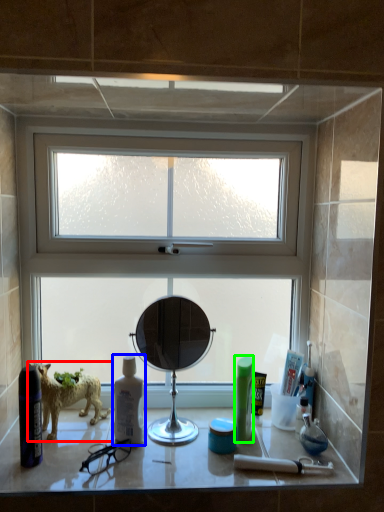
Question: Estimate the real-world distances between objects in this image. Which object is farther from dog (highlighted by a red box), mouthwash (highlighted by a blue box) or toiletry (highlighted by a green box)?

Choices:
 (A) mouthwash
 (B) toiletry

Answer: (B)